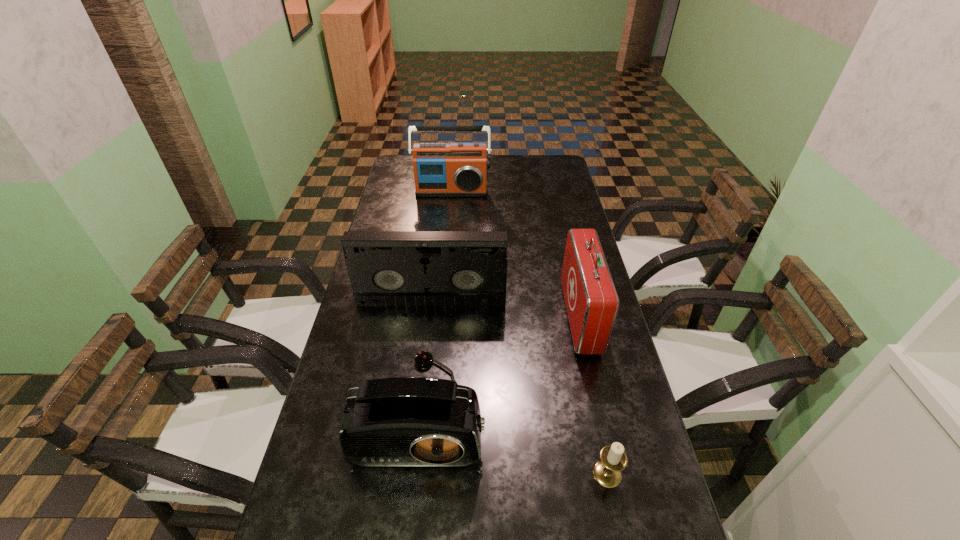
The image size is (960, 540). I want to click on free space between the first-aid kit and the farther radio receiver, so [x=516, y=254].

Locate an element on the screen. vacant space that is in between the videotape and the first-aid kit is located at coordinates (506, 308).

Where is `free space between the candle holder and the videotape`? The height and width of the screenshot is (540, 960). free space between the candle holder and the videotape is located at coordinates (519, 387).

The width and height of the screenshot is (960, 540). I want to click on object that is the closest to the farthest object, so click(591, 299).

The width and height of the screenshot is (960, 540). In order to click on object that can be found as the closest to the farthest object in this screenshot , I will do `click(591, 299)`.

You are a GUI agent. You are given a task and a screenshot of the screen. Output one action in this format:
    pyautogui.click(x=<x>, y=<y>)
    Task: Click on the vacant space that satisfies the following two spatial constraints: 1. on the front side of the videotape; 2. on the left side of the candle holder
    Image resolution: width=960 pixels, height=540 pixels.
    Given the screenshot: What is the action you would take?
    pyautogui.click(x=411, y=474)